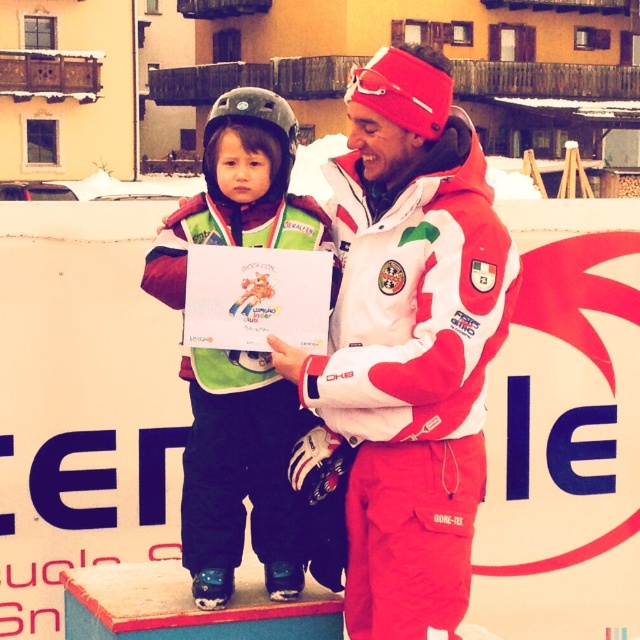
You are organizing a group photo and need to ensure participants are spaced at least 5 meters apart for safety. There are two people in the scene, one wearing a matte green snowsuit at center and another adult in red ski jacket on the right. Can they safely stand at the required distance apart?

The matte green snowsuit at center and the adult in red ski jacket on the right are 5.10 meters apart, which exceeds the 5 meter requirement. They can safely stand at the required distance apart.

You are a photographer at the event and want to take a photo of the matte green snowsuit at center and the matte gray helmet at upper center. Which object should you focus on first if you want to capture both in the frame without moving the camera?

The matte gray helmet at upper center should be focused on first because the matte green snowsuit at center is to the right of it, so adjusting focus to the helmet ensures both are in the frame without needing to reposition the camera.